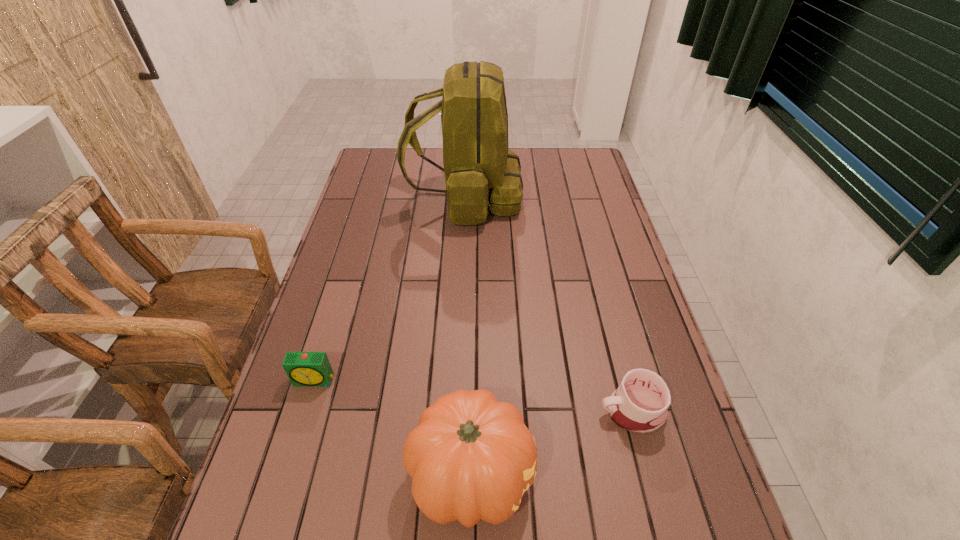
Locate an element on the screen. the tallest object is located at coordinates (480, 171).

Locate an element on the screen. backpack is located at coordinates (480, 171).

This screenshot has width=960, height=540. I want to click on the leftmost object, so click(x=302, y=368).

Locate an element on the screen. Image resolution: width=960 pixels, height=540 pixels. alarm clock is located at coordinates (302, 368).

Locate an element on the screen. the rightmost object is located at coordinates (639, 405).

The width and height of the screenshot is (960, 540). I want to click on vacant space located on the front-facing side of the tallest object, so click(588, 196).

You are a GUI agent. You are given a task and a screenshot of the screen. Output one action in this format:
    pyautogui.click(x=<x>, y=<y>)
    Task: Click on the free region located on the front-facing side of the alarm clock
    Image resolution: width=960 pixels, height=540 pixels.
    Given the screenshot: What is the action you would take?
    pyautogui.click(x=292, y=454)

You are a GUI agent. You are given a task and a screenshot of the screen. Output one action in this format:
    pyautogui.click(x=<x>, y=<y>)
    Task: Click on the free space located on the side with the handle of the rightmost object
    This screenshot has width=960, height=540.
    Given the screenshot: What is the action you would take?
    pyautogui.click(x=485, y=411)

I want to click on vacant space located on the side with the handle of the rightmost object, so point(445,411).

This screenshot has height=540, width=960. In order to click on vacant area situated on the side with the handle of the rightmost object in this screenshot , I will do `click(485, 411)`.